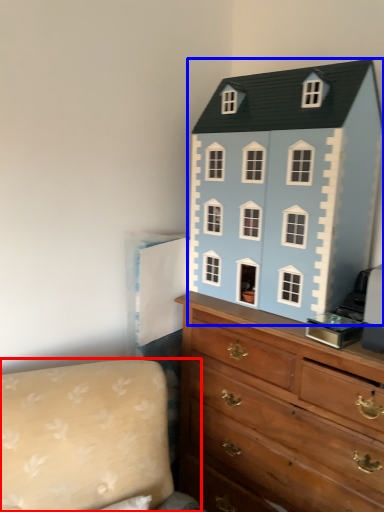
Question: Which point is further to the camera, couch (highlighted by a red box) or toy (highlighted by a blue box)?

Choices:
 (A) couch
 (B) toy

Answer: (B)